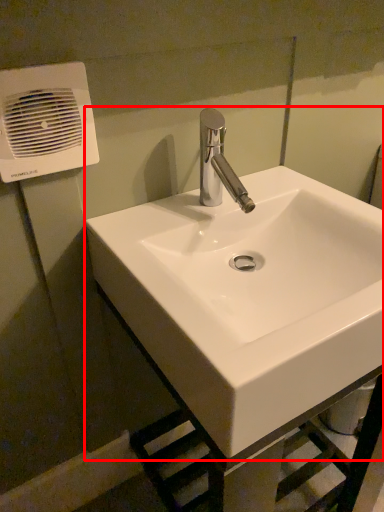
Question: Where is sink (annotated by the red box) located in relation to air conditioning in the image?

Choices:
 (A) right
 (B) left

Answer: (A)